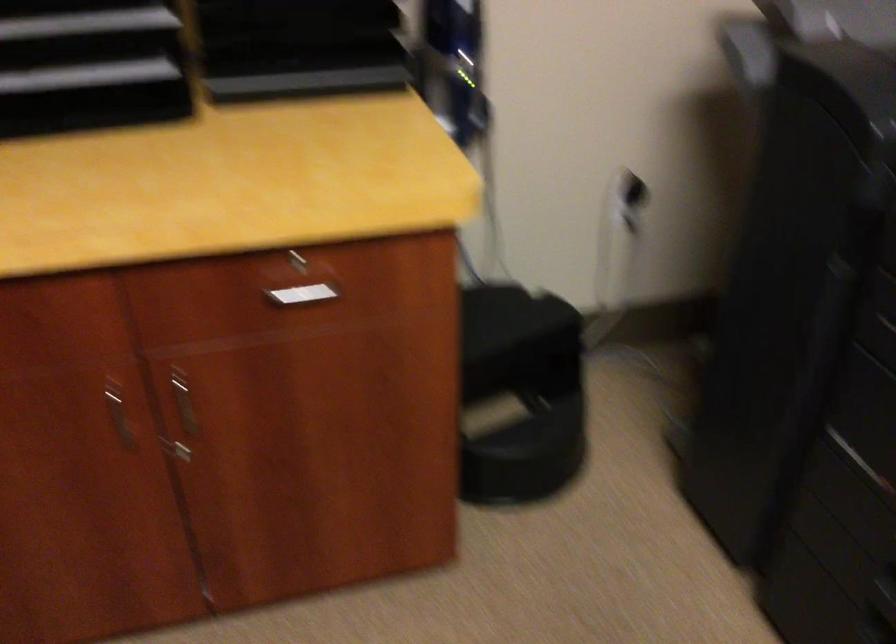
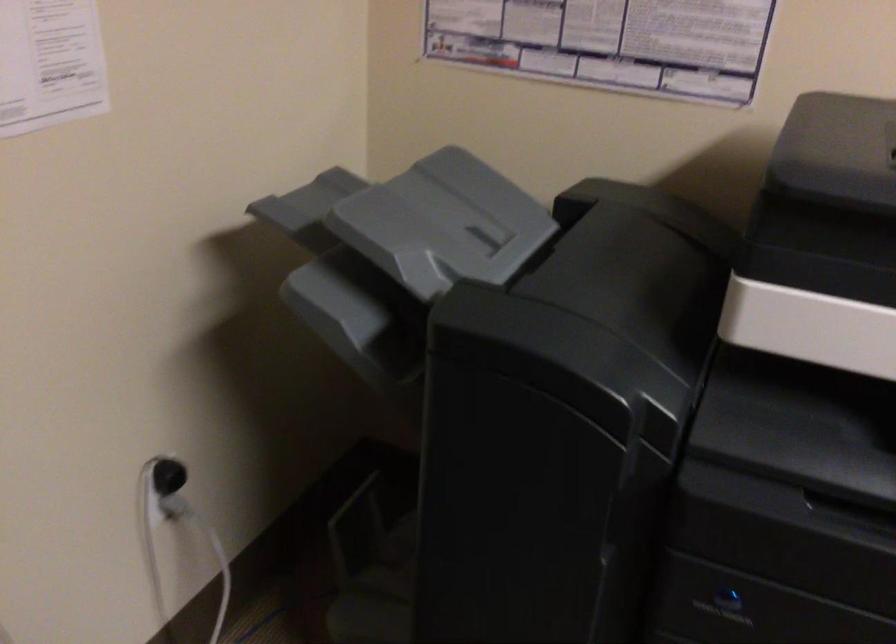
Where in the second image is the point corresponding to point (634, 193) from the first image?

(168, 476)